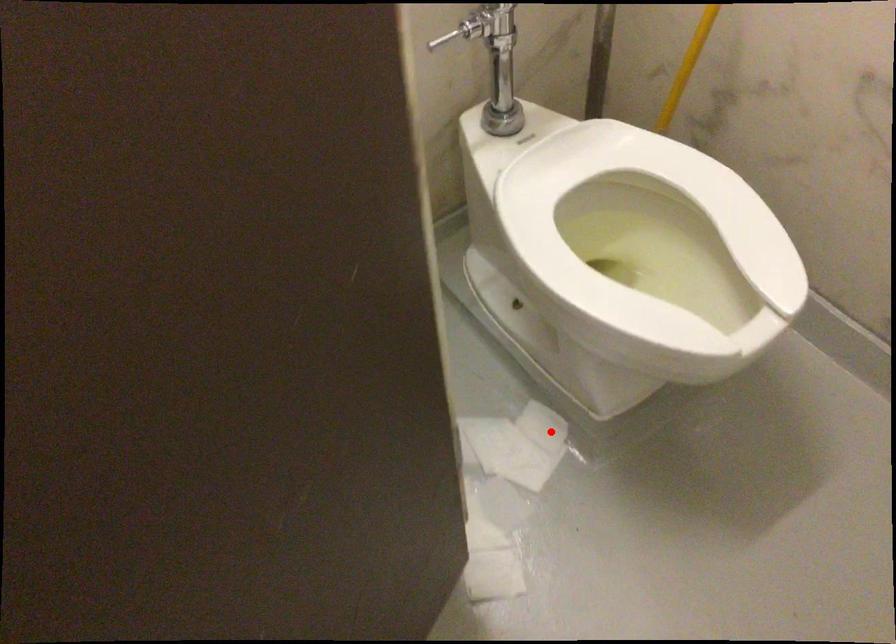
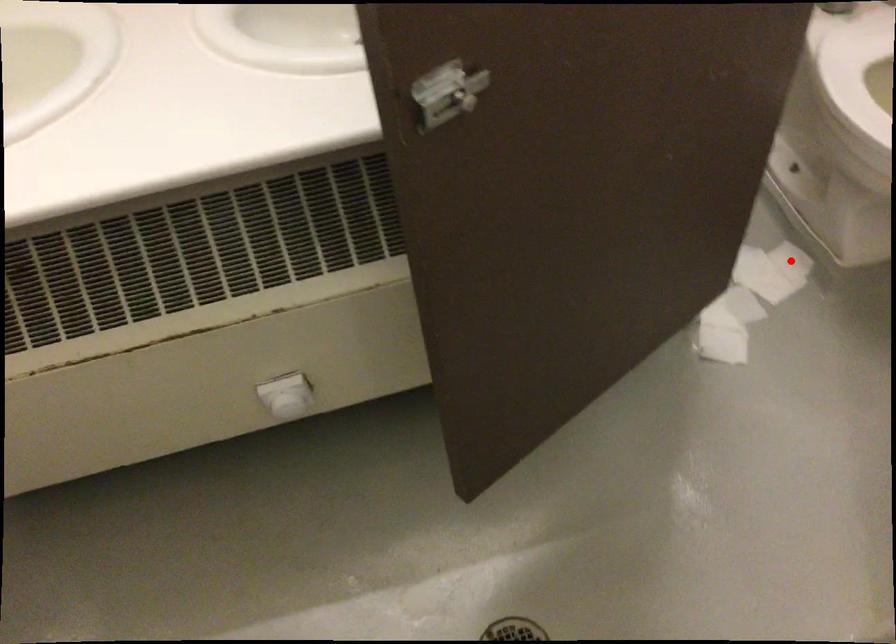
I am providing you with two images of the same scene from different viewpoints. A red point is marked on the first image and another point is marked on the second image. Do the highlighted points in image1 and image2 indicate the same real-world spot?

Yes